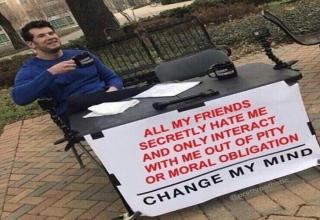
This screenshot has height=220, width=320. Identify the location of mug. (85, 58), (226, 69).